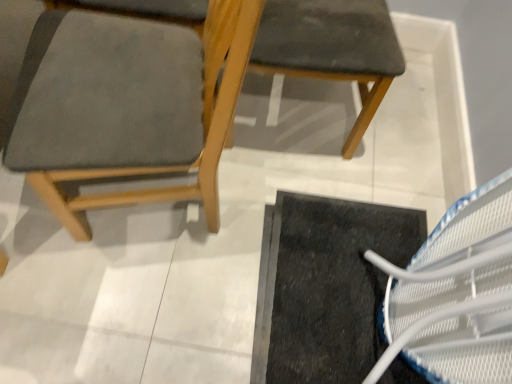
This screenshot has width=512, height=384. What do you see at coordinates (325, 286) in the screenshot?
I see `black rubber doormat at lower right` at bounding box center [325, 286].

Identify the location of matte gray fabric chair at left, which is the 2th chair from right to left. [x=127, y=105].

Considering the positions of objects black rubber doormat at lower right and matte gray fabric chair at left, which is the 2th chair from right to left, in the image provided, who is in front, black rubber doormat at lower right or matte gray fabric chair at left, which is the 2th chair from right to left,?

matte gray fabric chair at left, which is the 2th chair from right to left, is more forward.

Is black rubber doormat at lower right taller or shorter than matte gray fabric chair at left, acting as the 1th chair starting from the left?

Clearly, black rubber doormat at lower right is shorter compared to matte gray fabric chair at left, acting as the 1th chair starting from the left.

From the picture: Is matte gray fabric chair at left, which is the 2th chair from right to left, completely or partially inside black rubber doormat at lower right?

Definitely not — matte gray fabric chair at left, which is the 2th chair from right to left, is not inside black rubber doormat at lower right.

From the picture: From a real-world perspective, does black rubber doormat at lower right sit lower than matte gray fabric chair at left, which is the 2th chair from right to left?

Correct, in the physical world, black rubber doormat at lower right is lower than matte gray fabric chair at left, which is the 2th chair from right to left.

Considering the positions of objects black rubber doormat at lower right and matte gray cushion at upper right, marked as the first chair in a right-to-left arrangement, in the image provided, who is more to the right, black rubber doormat at lower right or matte gray cushion at upper right, marked as the first chair in a right-to-left arrangement,?

black rubber doormat at lower right is more to the right.

Is black rubber doormat at lower right further to the viewer compared to matte gray cushion at upper right, marked as the first chair in a right-to-left arrangement?

Yes, it is.

From the image's perspective, is black rubber doormat at lower right above matte gray cushion at upper right, marked as the first chair in a right-to-left arrangement?

No, from the image's perspective, black rubber doormat at lower right is not on top of matte gray cushion at upper right, marked as the first chair in a right-to-left arrangement.

Is black rubber doormat at lower right not within matte gray cushion at upper right, marked as the first chair in a right-to-left arrangement?

Yes, black rubber doormat at lower right is outside of matte gray cushion at upper right, marked as the first chair in a right-to-left arrangement.

Which object is closer to the camera, matte gray fabric chair at left, which is the 2th chair from right to left, or matte gray cushion at upper right, the 2th chair from the left?

matte gray fabric chair at left, which is the 2th chair from right to left, is closer to the camera.

Does matte gray fabric chair at left, which is the 2th chair from right to left, have a greater height compared to matte gray cushion at upper right, marked as the first chair in a right-to-left arrangement?

Indeed, matte gray fabric chair at left, which is the 2th chair from right to left, has a greater height compared to matte gray cushion at upper right, marked as the first chair in a right-to-left arrangement.

From a real-world perspective, is matte gray fabric chair at left, which is the 2th chair from right to left, physically located above or below matte gray cushion at upper right, the 2th chair from the left?

Clearly, from a real-world perspective, matte gray fabric chair at left, which is the 2th chair from right to left, is above matte gray cushion at upper right, the 2th chair from the left.

Is point (105, 68) behind point (334, 77)?

That is False.

Does matte gray cushion at upper right, marked as the first chair in a right-to-left arrangement, contain matte gray fabric chair at left, which is the 2th chair from right to left?

No, matte gray cushion at upper right, marked as the first chair in a right-to-left arrangement, does not contain matte gray fabric chair at left, which is the 2th chair from right to left.

Based on the photo, which object is closer to the camera, matte gray cushion at upper right, marked as the first chair in a right-to-left arrangement, or matte gray fabric chair at left, which is the 2th chair from right to left?

matte gray fabric chair at left, which is the 2th chair from right to left, is in front.

Is point (273, 49) in front of point (81, 122)?

No.

In the scene shown: Is matte gray cushion at upper right, marked as the first chair in a right-to-left arrangement, placed right next to black rubber doormat at lower right?

No, matte gray cushion at upper right, marked as the first chair in a right-to-left arrangement, is not next to black rubber doormat at lower right.

Looking at this image, is matte gray cushion at upper right, the 2th chair from the left, smaller than black rubber doormat at lower right?

Incorrect, matte gray cushion at upper right, the 2th chair from the left, is not smaller in size than black rubber doormat at lower right.

From the image's perspective, who appears lower, matte gray cushion at upper right, marked as the first chair in a right-to-left arrangement, or black rubber doormat at lower right?

black rubber doormat at lower right is shown below in the image.

Considering the sizes of objects matte gray cushion at upper right, marked as the first chair in a right-to-left arrangement, and black rubber doormat at lower right in the image provided, who is taller, matte gray cushion at upper right, marked as the first chair in a right-to-left arrangement, or black rubber doormat at lower right?

matte gray cushion at upper right, marked as the first chair in a right-to-left arrangement, is taller.

Looking at this image, who is more distant, matte gray fabric chair at left, acting as the 1th chair starting from the left, or black rubber doormat at lower right?

Positioned behind is black rubber doormat at lower right.

Between matte gray fabric chair at left, which is the 2th chair from right to left, and black rubber doormat at lower right, which one has smaller size?

With smaller size is black rubber doormat at lower right.

Considering the positions of point (42, 26) and point (353, 345), is point (42, 26) closer or farther from the camera than point (353, 345)?

Point (42, 26) appears to be closer to the viewer than point (353, 345).

Locate an element on the screen. doormat below the matte gray fabric chair at left, which is the 2th chair from right to left (from a real-world perspective) is located at coordinates (325, 286).

The image size is (512, 384). Find the location of `doormat that is behind the matte gray fabric chair at left, acting as the 1th chair starting from the left`. doormat that is behind the matte gray fabric chair at left, acting as the 1th chair starting from the left is located at coordinates coord(325,286).

The width and height of the screenshot is (512, 384). Identify the location of the 1st chair located above the black rubber doormat at lower right (from a real-world perspective). (332, 48).

Which object lies nearer to the anchor point matte gray cushion at upper right, the 2th chair from the left, black rubber doormat at lower right or matte gray fabric chair at left, acting as the 1th chair starting from the left?

matte gray fabric chair at left, acting as the 1th chair starting from the left, lies closer to matte gray cushion at upper right, the 2th chair from the left, than the other object.

From the image, which object appears to be nearer to matte gray fabric chair at left, acting as the 1th chair starting from the left, matte gray cushion at upper right, marked as the first chair in a right-to-left arrangement, or black rubber doormat at lower right?

Based on the image, matte gray cushion at upper right, marked as the first chair in a right-to-left arrangement, appears to be nearer to matte gray fabric chair at left, acting as the 1th chair starting from the left.

Estimate the real-world distances between objects in this image. Which object is closer to matte gray cushion at upper right, the 2th chair from the left, matte gray fabric chair at left, which is the 2th chair from right to left, or black rubber doormat at lower right?

matte gray fabric chair at left, which is the 2th chair from right to left.

Which object lies further to the anchor point black rubber doormat at lower right, matte gray cushion at upper right, marked as the first chair in a right-to-left arrangement, or matte gray fabric chair at left, acting as the 1th chair starting from the left?

Among the two, matte gray fabric chair at left, acting as the 1th chair starting from the left, is located further to black rubber doormat at lower right.

From the image, which object appears to be nearer to matte gray fabric chair at left, which is the 2th chair from right to left, black rubber doormat at lower right or matte gray cushion at upper right, the 2th chair from the left?

matte gray cushion at upper right, the 2th chair from the left, is closer to matte gray fabric chair at left, which is the 2th chair from right to left.

Considering their positions, is matte gray fabric chair at left, acting as the 1th chair starting from the left, positioned further to black rubber doormat at lower right than matte gray cushion at upper right, marked as the first chair in a right-to-left arrangement?

matte gray fabric chair at left, acting as the 1th chair starting from the left, is positioned further to the anchor black rubber doormat at lower right.

Where is `chair that lies between matte gray cushion at upper right, marked as the first chair in a right-to-left arrangement, and black rubber doormat at lower right from top to bottom`? The width and height of the screenshot is (512, 384). chair that lies between matte gray cushion at upper right, marked as the first chair in a right-to-left arrangement, and black rubber doormat at lower right from top to bottom is located at coordinates (127, 105).